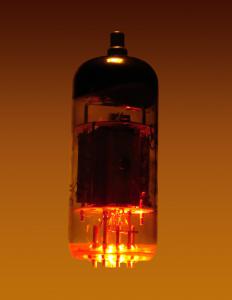
Locate an element on the screen. The image size is (232, 300). light fixture is located at coordinates (148, 244).